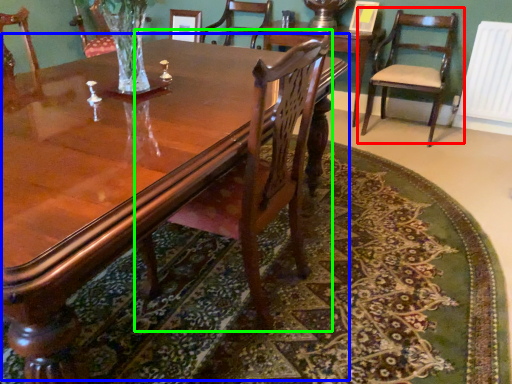
Question: Which is nearer to the chair (highlighted by a red box)? coffee table (highlighted by a blue box) or chair (highlighted by a green box).

Choices:
 (A) coffee table
 (B) chair

Answer: (A)